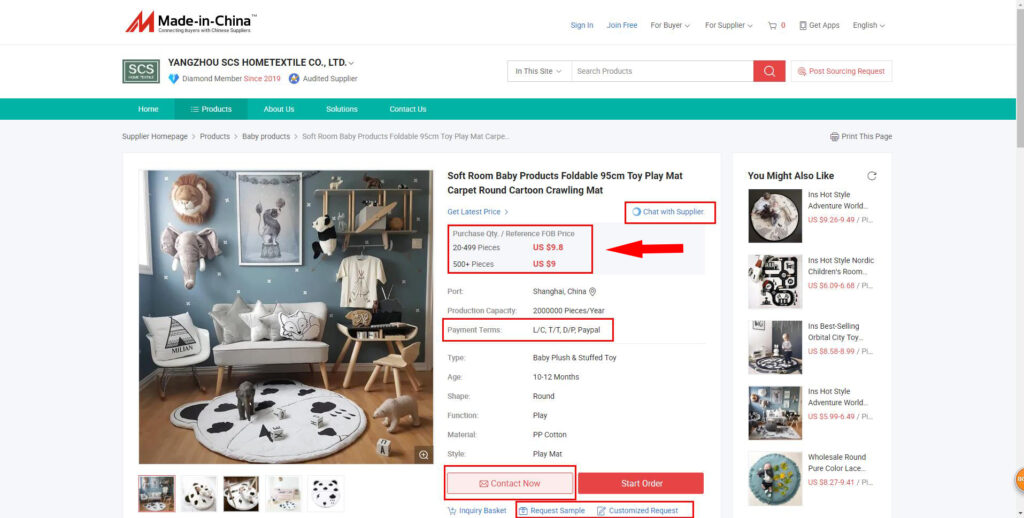
Where is `mounted toy elephant head`? mounted toy elephant head is located at coordinates (188, 256).